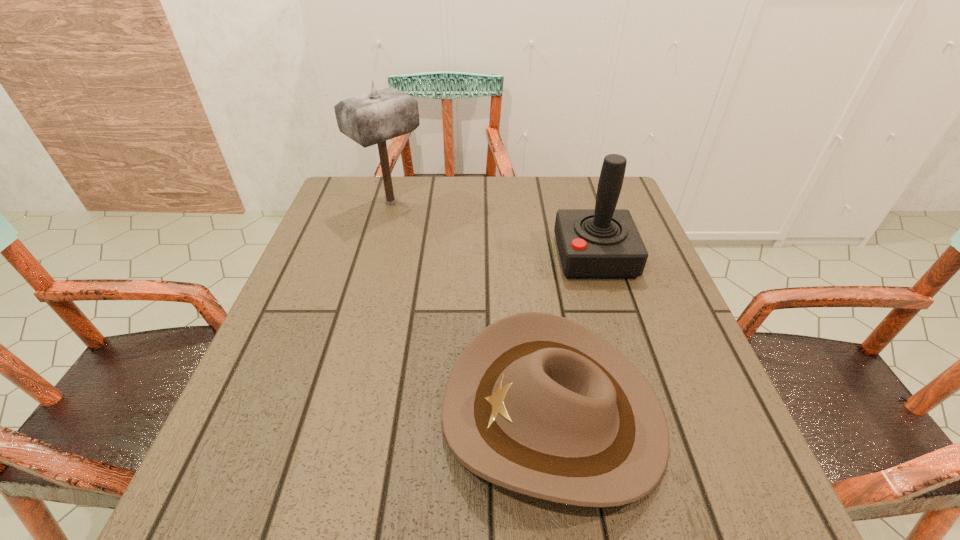
Identify the location of free space located 0.130m with a star on the front of the cowboy hat. (365, 413).

The height and width of the screenshot is (540, 960). Identify the location of free point located 0.210m with a star on the front of the cowboy hat. [317, 413].

This screenshot has width=960, height=540. I want to click on vacant point located 0.260m with a star on the front of the cowboy hat, so click(x=286, y=413).

Where is `object that is positioned at the far edge`? This screenshot has height=540, width=960. object that is positioned at the far edge is located at coordinates (x=373, y=118).

Image resolution: width=960 pixels, height=540 pixels. Find the location of `object at the near edge`. object at the near edge is located at coordinates (538, 404).

Find the location of a particular element. object that is at the left edge is located at coordinates (373, 118).

Find the location of `joystick that is positioned at the right edge`. joystick that is positioned at the right edge is located at coordinates (604, 242).

Locate an element on the screen. cowboy hat situated at the right edge is located at coordinates (538, 404).

Where is `object positioned at the far left corner`? The image size is (960, 540). object positioned at the far left corner is located at coordinates (373, 118).

Locate an element on the screen. object present at the near right corner is located at coordinates (538, 404).